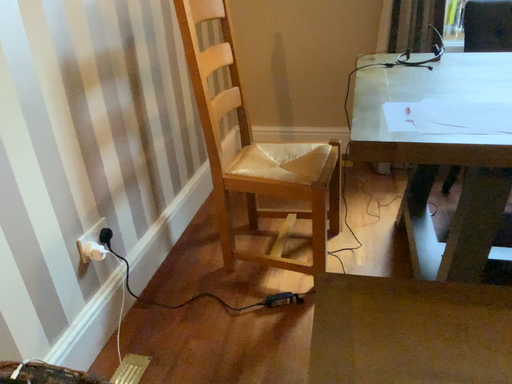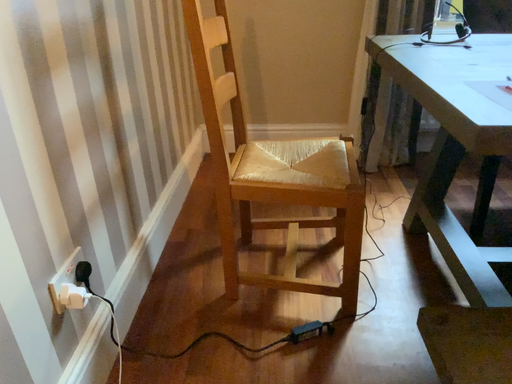
Question: Which way did the camera rotate in the video?

Choices:
 (A) rotated left
 (B) rotated right

Answer: (B)